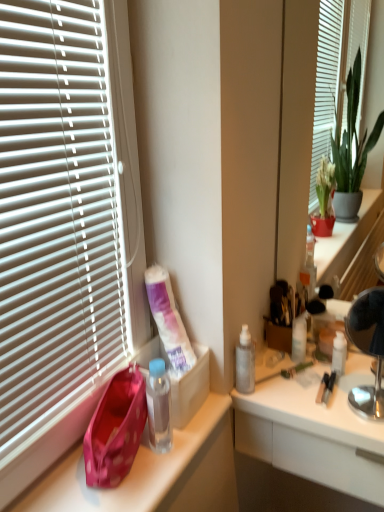
In order to click on free space to the right of transparent plastic bottle at center-right in this screenshot , I will do `click(313, 393)`.